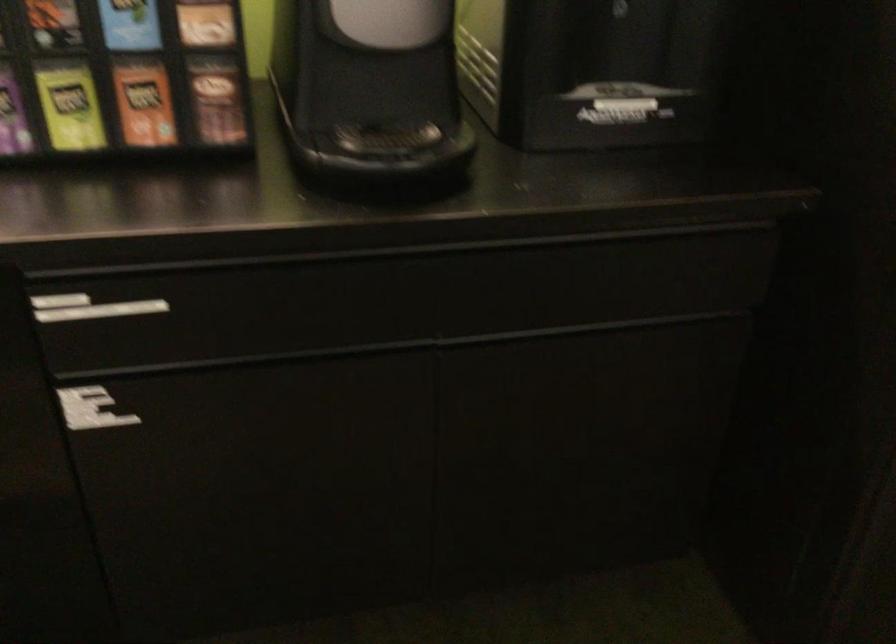
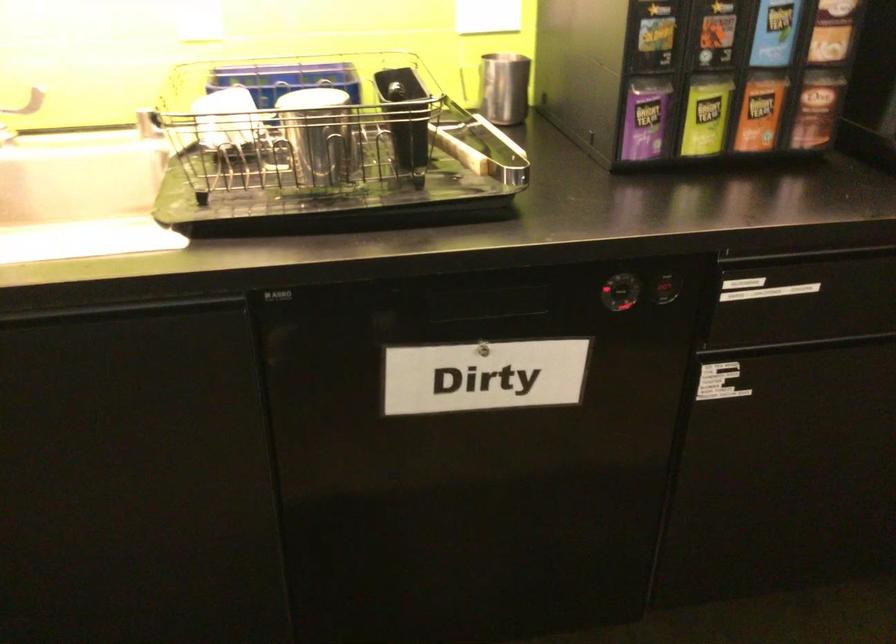
Question: The first image is from the beginning of the video and the second image is from the end. How did the camera likely rotate when shooting the video?

Choices:
 (A) Left
 (B) Right
 (C) Up
 (D) Down

Answer: (A)